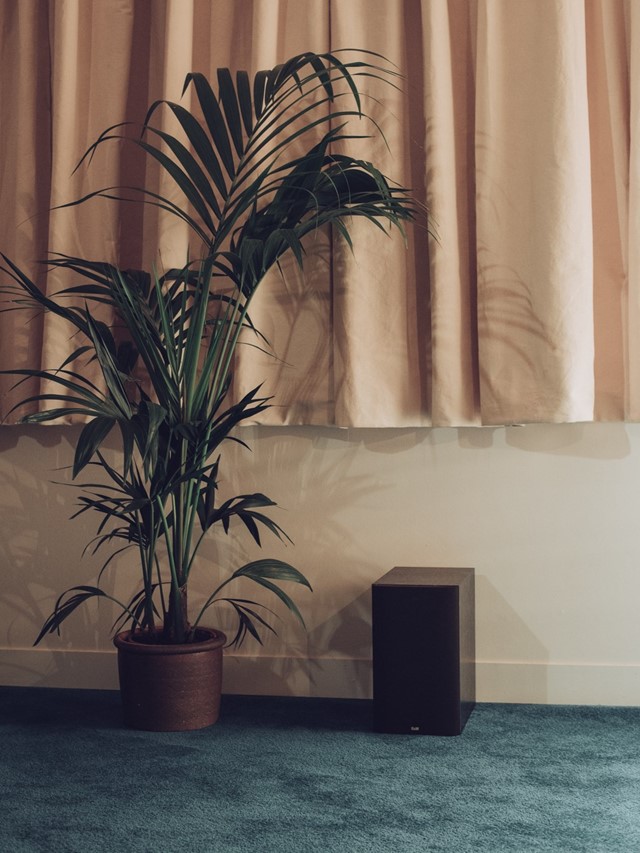
This screenshot has width=640, height=853. In order to click on curtain in this screenshot , I will do `click(523, 334)`.